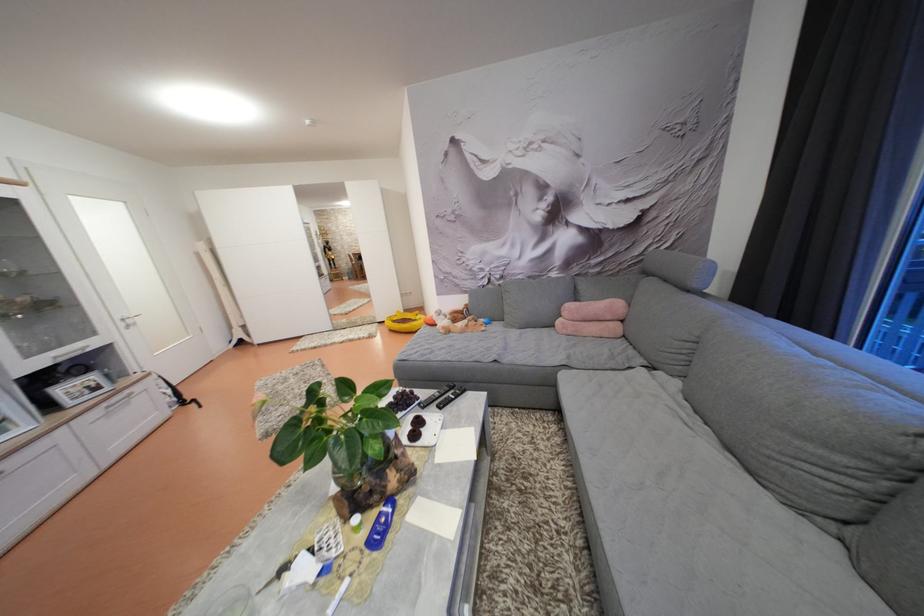
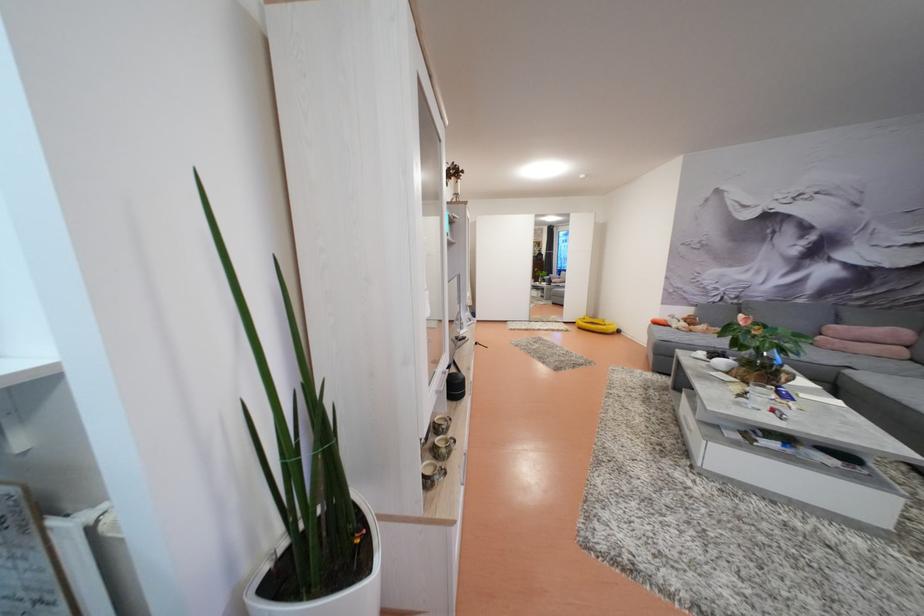
Locate, in the second image, the point that corresponds to pixel 623 333 in the first image.

(908, 355)